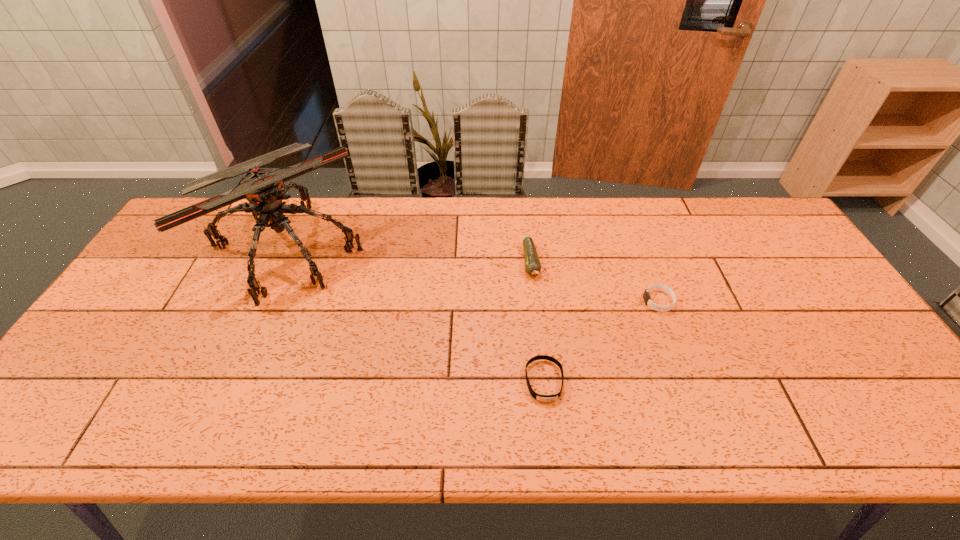
Identify which object is the second nearest to the leftmost object. Please provide its 2D coordinates. Your answer should be formatted as a tuple, i.e. [(x, y)], where the tuple contains the x and y coordinates of a point satisfying the conditions above.

[(543, 398)]

You are a GUI agent. You are given a task and a screenshot of the screen. Output one action in this format:
    pyautogui.click(x=<x>, y=<y>)
    Task: Click on the object that is the closest one to the shortest object
    Image resolution: width=960 pixels, height=540 pixels.
    Given the screenshot: What is the action you would take?
    pyautogui.click(x=532, y=263)

The image size is (960, 540). I want to click on free point that satisfies the following two spatial constraints: 1. on the outer surface of the rightmost object; 2. on the display of the shortest object, so click(x=688, y=381).

This screenshot has width=960, height=540. I want to click on free spot that satisfies the following two spatial constraints: 1. on the outer surface of the right wristband; 2. on the display of the left wristband, so tap(688, 381).